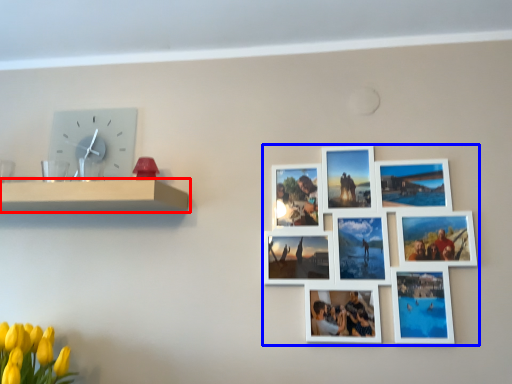
Question: Which point is closer to the camera, shelf (highlighted by a red box) or picture frame (highlighted by a blue box)?

Choices:
 (A) shelf
 (B) picture frame

Answer: (A)